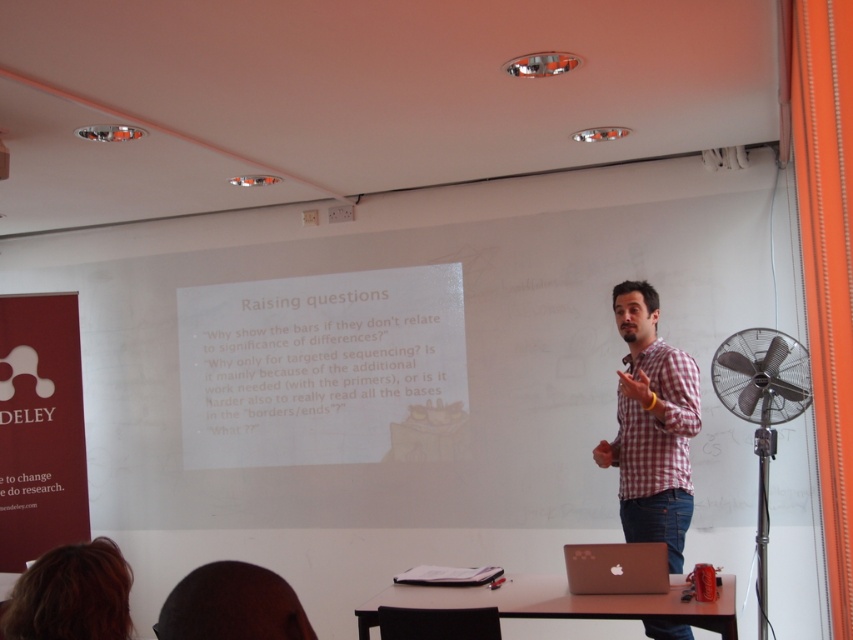
Is checkered fabric shirt at center positioned at the back of satin gold laptop at center?

Yes, checkered fabric shirt at center is further from the viewer.

Which is behind, point (653, 476) or point (567, 560)?

The point (653, 476) is behind.

Is point (677, 632) positioned in front of point (640, 560)?

No, (677, 632) is further to viewer.

The height and width of the screenshot is (640, 853). I want to click on checkered fabric shirt at center, so click(x=653, y=428).

Between point (202, 637) and point (604, 588), which one is positioned behind?

The point (604, 588) is behind.

Is dark hair at lower left bigger than satin gold laptop at center?

Yes.

Which is in front, point (254, 566) or point (633, 577)?

Point (254, 566) is in front.

Identify the location of dark hair at lower left. This screenshot has width=853, height=640. click(x=231, y=605).

Looking at this image, can you confirm if checkered fabric shirt at center is positioned above black matte microphone at center?

Incorrect, checkered fabric shirt at center is not positioned above black matte microphone at center.

Locate an element on the screen. This screenshot has width=853, height=640. checkered fabric shirt at center is located at coordinates (653, 428).